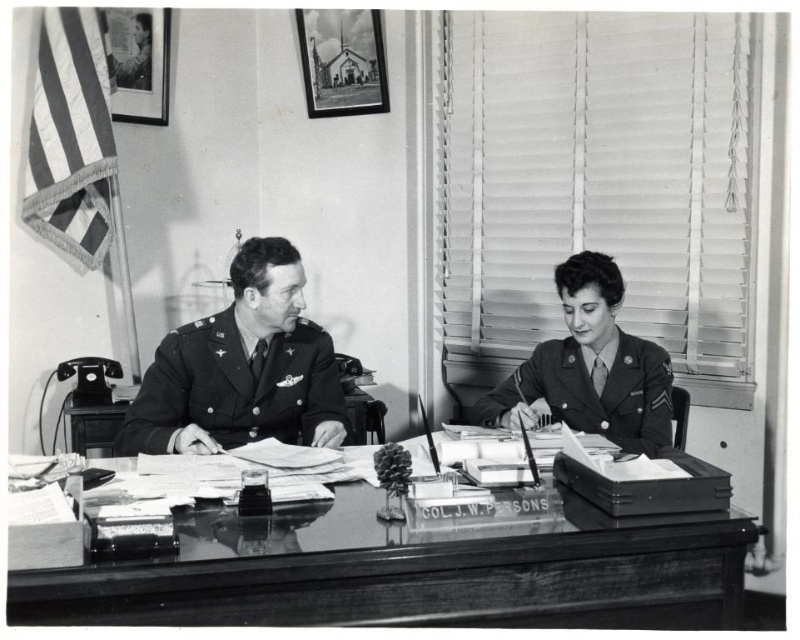
Question: Which of the following is the closest to the observer?

Choices:
 (A) (332, 579)
 (B) (604, 300)

Answer: (A)

Question: Is glossy wood table at center positioned at the back of uniformed woman at center?

Choices:
 (A) yes
 (B) no

Answer: (B)

Question: Estimate the real-world distances between objects in this image. Which object is farther from the uniformed officer at center?

Choices:
 (A) glossy wood table at center
 (B) uniformed woman at center

Answer: (B)

Question: Which of the following is the closest to the observer?

Choices:
 (A) uniformed officer at center
 (B) glossy wood table at center

Answer: (B)

Question: Can you confirm if uniformed officer at center is positioned below uniformed woman at center?

Choices:
 (A) no
 (B) yes

Answer: (A)

Question: Observing the image, what is the correct spatial positioning of uniformed officer at center in reference to uniformed woman at center?

Choices:
 (A) below
 (B) above

Answer: (B)